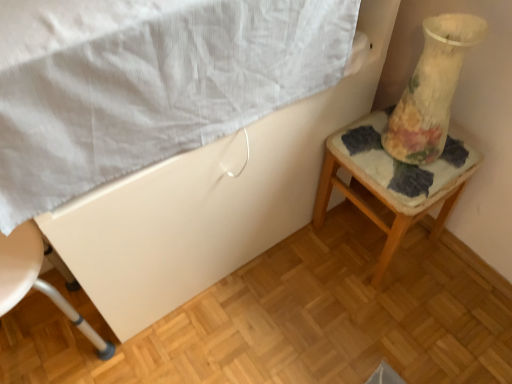
Where is `blank area beneath floral fabric cushion at right (from a real-world perspective)`? Image resolution: width=512 pixels, height=384 pixels. blank area beneath floral fabric cushion at right (from a real-world perspective) is located at coordinates (372, 242).